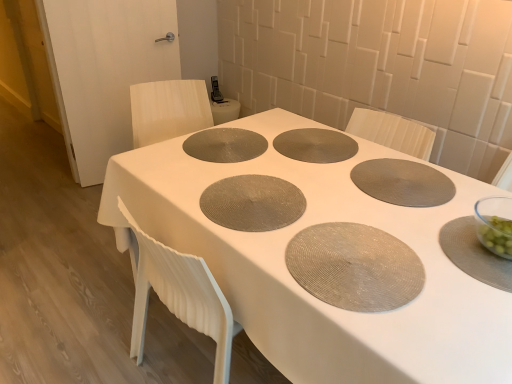
Image resolution: width=512 pixels, height=384 pixels. I want to click on free spot in front of matte gray placemat at center, positioned as the 3th pizza pan in right-to-left order, so click(283, 251).